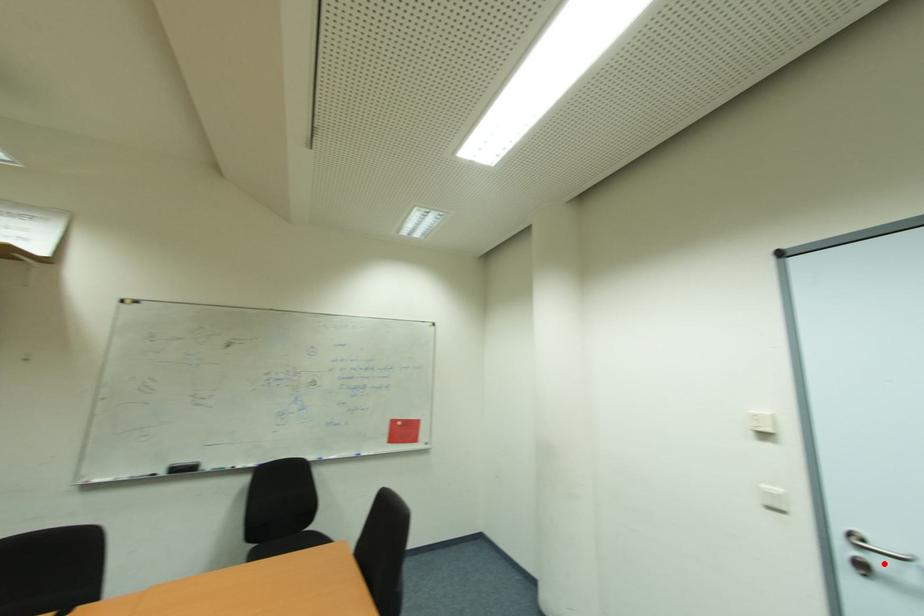
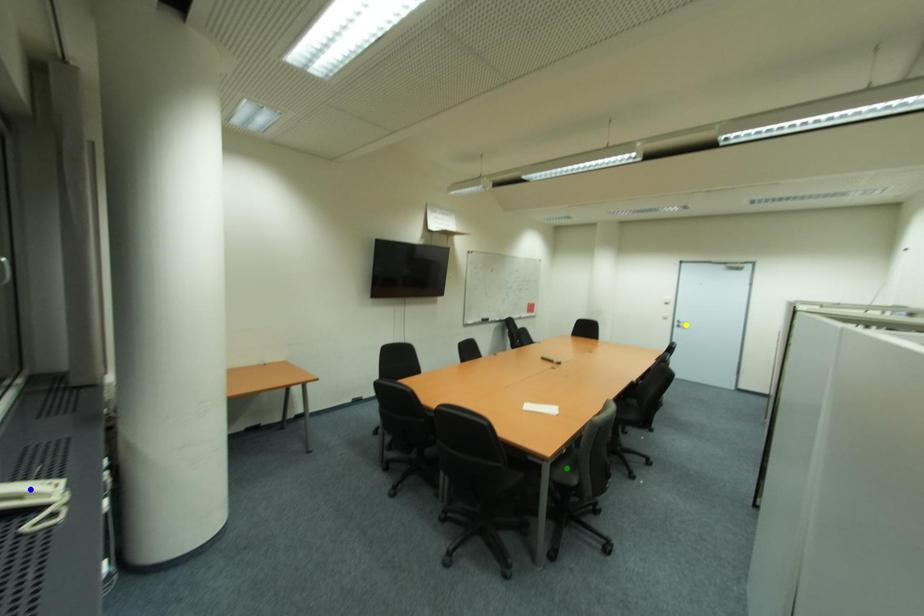
Question: I am providing you with two images of the same scene from different viewpoints. A red point is marked on the first image. You are given multiple points on the second image. In image 2, which mark is for the same physical point as the one in image 1?

Choices:
 (A) green point
 (B) yellow point
 (C) blue point

Answer: (B)